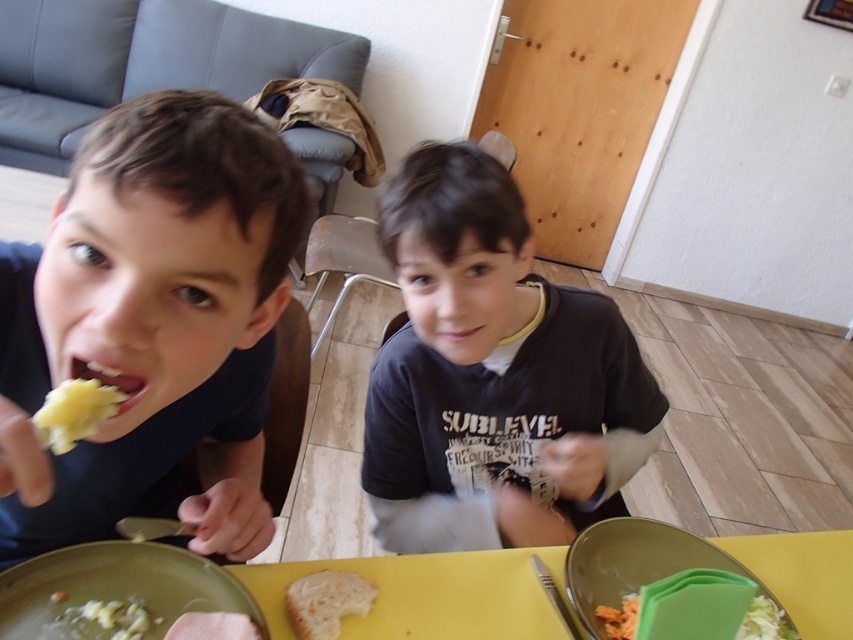
Question: Is white bread at lower center above white creamy pasta at lower left?

Choices:
 (A) no
 (B) yes

Answer: (B)

Question: Is dark blue t-shirt at center below yellow matte table at center?

Choices:
 (A) no
 (B) yes

Answer: (A)

Question: Can you confirm if white creamy potato at center is smaller than pink matte skin at center?

Choices:
 (A) no
 (B) yes

Answer: (A)

Question: Which object appears closest to the camera in this image?

Choices:
 (A) pink soft bread at center
 (B) matte black shirt at left
 (C) dark blue t-shirt at center

Answer: (B)

Question: Which object appears farthest from the camera in this image?

Choices:
 (A) matte yellow food at mouth left
 (B) white creamy pasta at lower left
 (C) white matte bread at lower center

Answer: (C)

Question: Which point is closer to the camera taking this photo?

Choices:
 (A) (126, 381)
 (B) (93, 550)

Answer: (A)